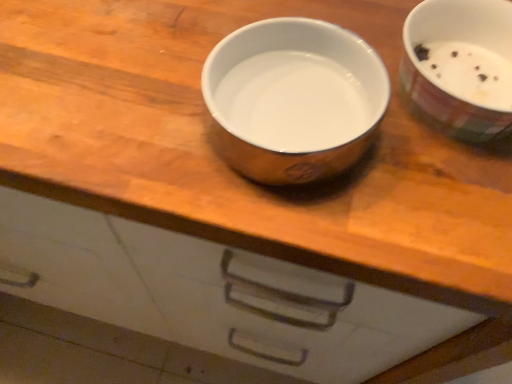
Locate an element on the screen. vacant region to the left of white glossy bowl at upper right, the 2th tableware from the left is located at coordinates (274, 62).